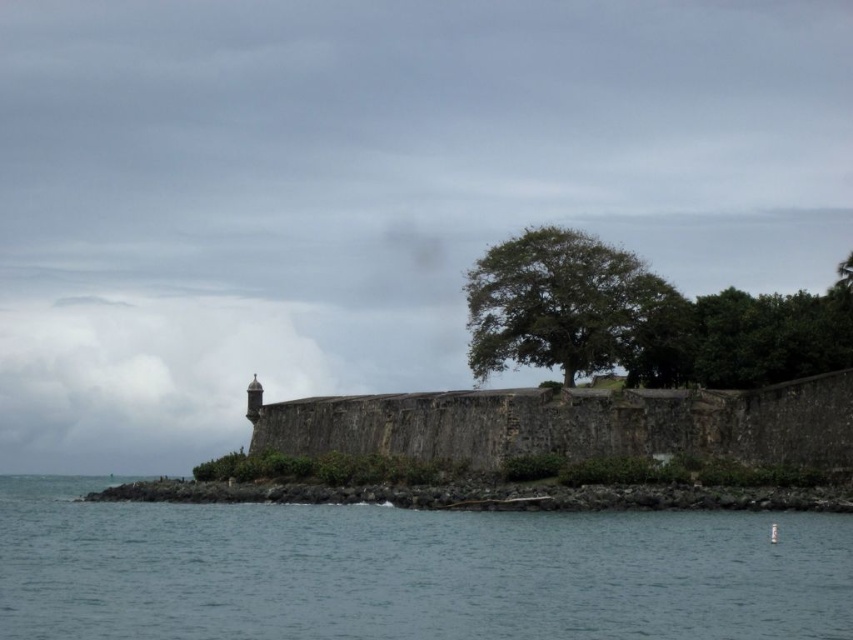
Which is more to the left, blue water at lower left or weathered stone fort at center?

blue water at lower left

Can you confirm if blue water at lower left is wider than weathered stone fort at center?

Indeed, blue water at lower left has a greater width compared to weathered stone fort at center.

Locate an element on the screen. The height and width of the screenshot is (640, 853). blue water at lower left is located at coordinates (409, 572).

Is blue water at lower left taller than green leafy tree at center?

In fact, blue water at lower left may be shorter than green leafy tree at center.

Which of these two, blue water at lower left or green leafy tree at center, stands taller?

Standing taller between the two is green leafy tree at center.

Is point (1, 564) closer to camera compared to point (578, 340)?

Yes.

You are a GUI agent. You are given a task and a screenshot of the screen. Output one action in this format:
    pyautogui.click(x=<x>, y=<y>)
    Task: Click on the blue water at lower left
    
    Given the screenshot: What is the action you would take?
    pyautogui.click(x=409, y=572)

Between point (492, 298) and point (672, 486), which one is positioned behind?

Positioned behind is point (492, 298).

The image size is (853, 640). Identify the location of green leafy tree at center. (560, 304).